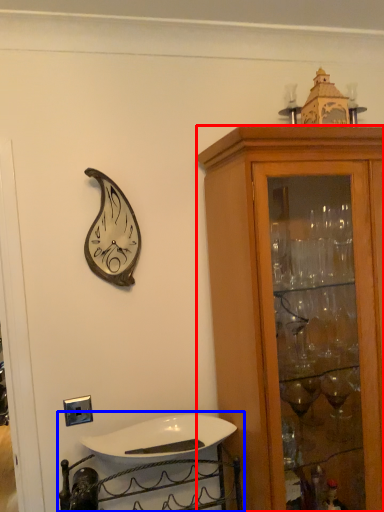
Question: Which object appears closest to the camera in this image, cabinetry (highlighted by a red box) or sink (highlighted by a blue box)?

Choices:
 (A) cabinetry
 (B) sink

Answer: (A)